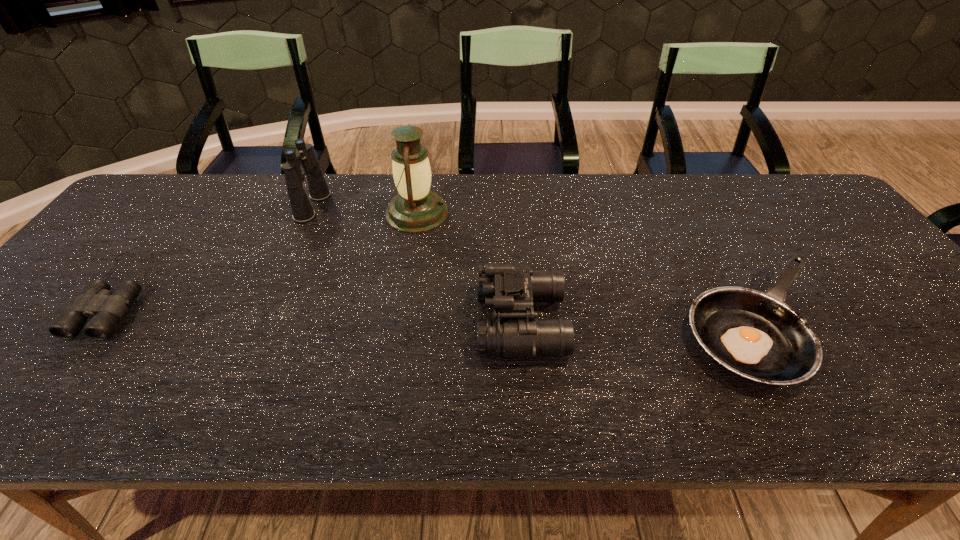
This screenshot has height=540, width=960. Identify the location of free space located on the front of the tallest binoculars. (278, 285).

Locate an element on the screen. blank space located through the lenses of the rightmost binoculars is located at coordinates (396, 322).

Identify the location of vacant space located through the lenses of the rightmost binoculars. (443, 322).

Where is `vacant space located 0.090m through the lenses of the rightmost binoculars`? The height and width of the screenshot is (540, 960). vacant space located 0.090m through the lenses of the rightmost binoculars is located at coordinates (439, 322).

In order to click on free point located at the eyepiece of the shortest binoculars in this screenshot , I will do `click(59, 373)`.

Image resolution: width=960 pixels, height=540 pixels. I want to click on free location located on the back of the frying pan, so click(678, 182).

Find the location of a particular element. The height and width of the screenshot is (540, 960). lantern situated at the far edge is located at coordinates (415, 209).

At what (x,y) coordinates should I click in order to perform the action: click on binoculars present at the far edge. Please return your answer as a coordinate pair (x, y). The width and height of the screenshot is (960, 540). Looking at the image, I should click on (302, 210).

Where is `object that is at the near edge`? The image size is (960, 540). object that is at the near edge is located at coordinates (755, 335).

At what (x,y) coordinates should I click in order to perform the action: click on object located in the left edge section of the desktop. Please return your answer as a coordinate pair (x, y). This screenshot has width=960, height=540. Looking at the image, I should click on (96, 301).